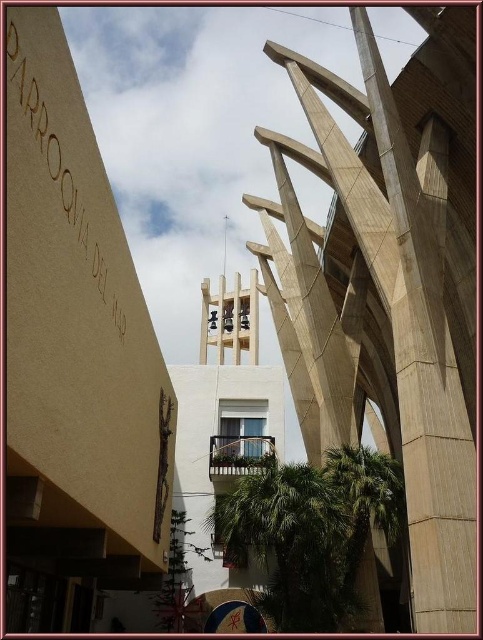
You are standing in front of the modern religious building and want to take a photo. You notice two points marked on the structure. The first point is at coordinate point (59, 195) and the second is at point (223, 497). Which point will appear larger in your camera view?

Point (59, 195) is closer to the camera than point (223, 497), so it will appear larger in the camera view.

You are standing at the base of the green leafy palm tree at center and want to place a 10 meter long banner between it and the gold cardboard sign at upper left. Will the banner be long enough to stretch between them?

The gold cardboard sign at upper left and green leafy palm tree at center are 27.02 meters apart. The banner is only 10 meters long, so it will not be long enough to stretch between them.